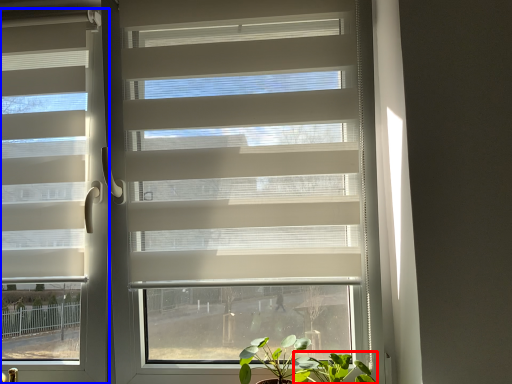
Question: Which object is closer to the camera taking this photo, vegetation (highlighted by a red box) or window blind (highlighted by a blue box)?

Choices:
 (A) vegetation
 (B) window blind

Answer: (A)